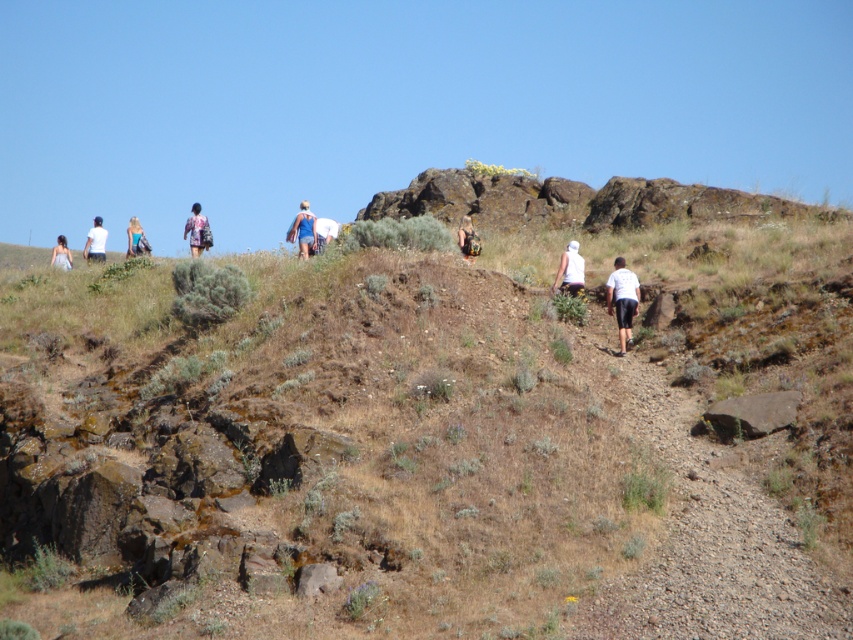
You are planning to hike along the trail and want to ensure your matte black backpack at center won t get stuck. Since the brown dirt path at center is narrow, can you confirm if the path is wide enough for your backpack?

The brown dirt path at center is bigger than the matte black backpack at center, so the path is wide enough for your backpack.

You are a hiker who wants to locate the white matte shirt at center in the image. According to the coordinates provided, where should you look?

The white matte shirt at center is located at point coordinates (570, 269).